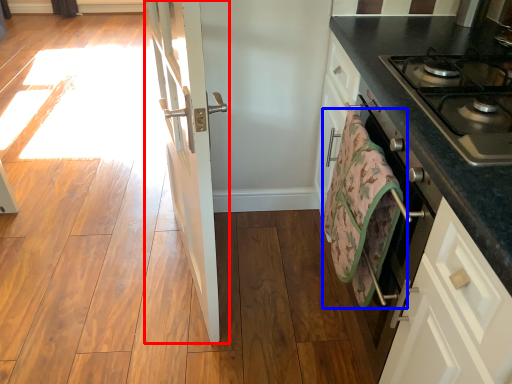
Question: Which object appears closest to the camera in this image, door (highlighted by a red box) or beach towel (highlighted by a blue box)?

Choices:
 (A) door
 (B) beach towel

Answer: (A)